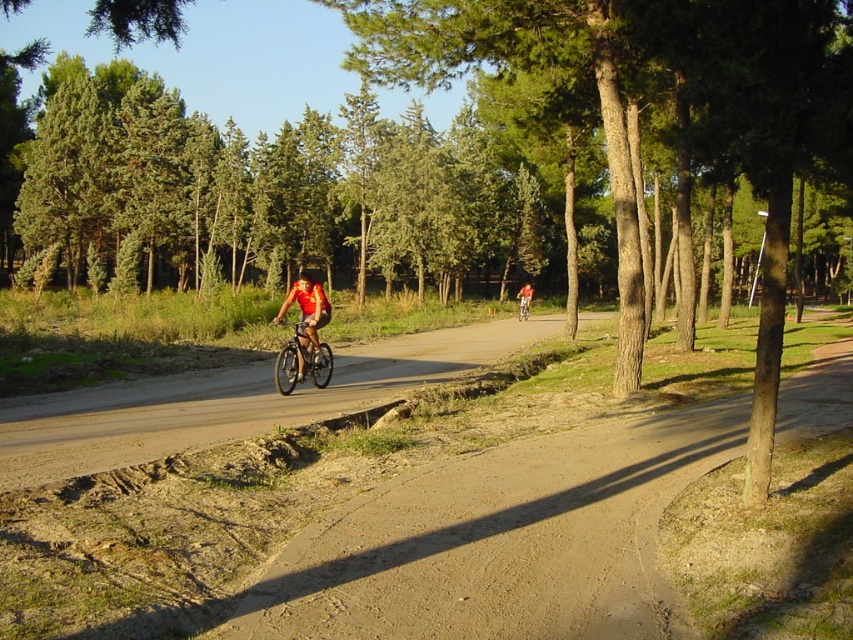
Question: Which of the following is the closest to the observer?

Choices:
 (A) tap(311, 278)
 (B) tap(524, 316)

Answer: (A)

Question: Which of the following is the closest to the observer?

Choices:
 (A) (309, 273)
 (B) (520, 317)

Answer: (B)

Question: Is matte black bicycle at center smaller than black matte bicycle helmet at center?

Choices:
 (A) no
 (B) yes

Answer: (B)

Question: Can you confirm if matte black bicycle at center is positioned to the right of black matte bicycle helmet at center?

Choices:
 (A) no
 (B) yes

Answer: (B)

Question: Does matte black bicycle at center have a smaller size compared to black matte bicycle helmet at center?

Choices:
 (A) no
 (B) yes

Answer: (B)